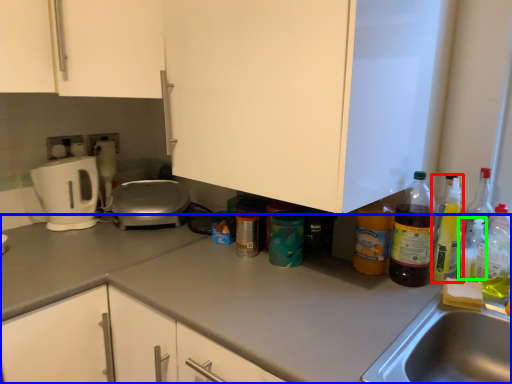
Question: Considering the real-world distances, which object is closest to bottle (highlighted by a red box)? countertop (highlighted by a blue box) or bottle (highlighted by a green box).

Choices:
 (A) countertop
 (B) bottle

Answer: (B)